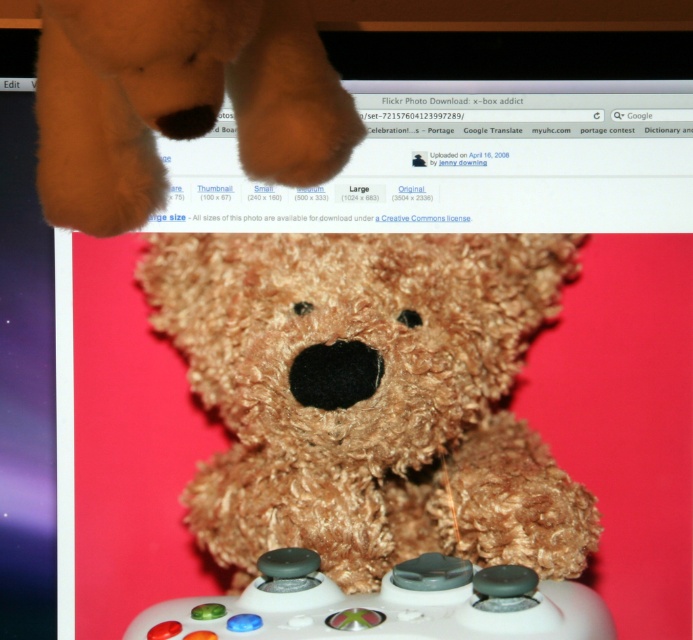
Question: Does fuzzy brown teddy bear at upper left appear on the right side of white matte game controller at center?

Choices:
 (A) no
 (B) yes

Answer: (A)

Question: Which of the following is the closest to the observer?

Choices:
 (A) (403, 627)
 (B) (385, 468)

Answer: (A)

Question: Estimate the real-world distances between objects in this image. Which object is farther from the fuzzy brown teddy bear at center?

Choices:
 (A) white matte game controller at center
 (B) fuzzy brown teddy bear at upper left

Answer: (B)

Question: Is fuzzy brown teddy bear at center in front of fuzzy brown teddy bear at upper left?

Choices:
 (A) no
 (B) yes

Answer: (A)

Question: Is fuzzy brown teddy bear at upper left above white matte game controller at center?

Choices:
 (A) no
 (B) yes

Answer: (B)

Question: Among these points, which one is nearest to the camera?

Choices:
 (A) (346, 138)
 (B) (545, 509)
 (C) (288, 572)

Answer: (A)